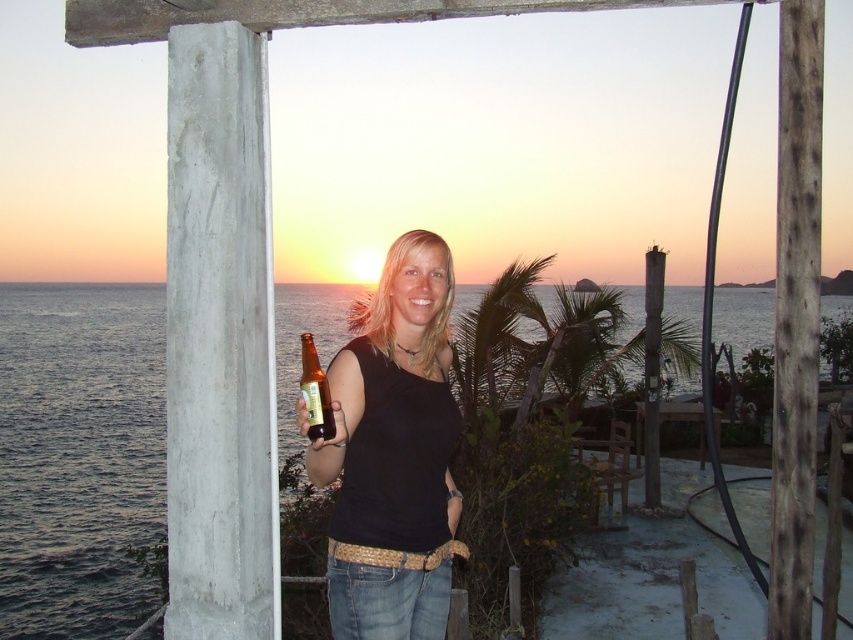
Is point (286, 337) behind point (451, 436)?

Yes, it is behind point (451, 436).

Can you confirm if blue water at lower left is positioned above matte black tank top at center?

Correct, blue water at lower left is located above matte black tank top at center.

This screenshot has width=853, height=640. Find the location of `blue water at lower left`. blue water at lower left is located at coordinates (78, 456).

Who is taller, blue water at lower left or translucent glass bottle at center?

Standing taller between the two is blue water at lower left.

Is blue water at lower left to the right of translucent glass bottle at center from the viewer's perspective?

Yes, blue water at lower left is to the right of translucent glass bottle at center.

Is point (44, 320) positioned in front of point (305, 388)?

No, it is behind (305, 388).

Find the location of `blue water at lower left`. blue water at lower left is located at coordinates (78, 456).

Can you confirm if matte black tank top at center is smaller than translucent glass bottle at center?

No, matte black tank top at center is not smaller than translucent glass bottle at center.

Does matte black tank top at center have a larger size compared to translucent glass bottle at center?

Yes.

Which is in front, point (393, 563) or point (328, 433)?

Positioned in front is point (328, 433).

You are a GUI agent. You are given a task and a screenshot of the screen. Output one action in this format:
    pyautogui.click(x=<x>, y=<y>)
    Task: Click on the matte black tank top at center
    The image size is (853, 640).
    Given the screenshot: What is the action you would take?
    pyautogui.click(x=393, y=452)